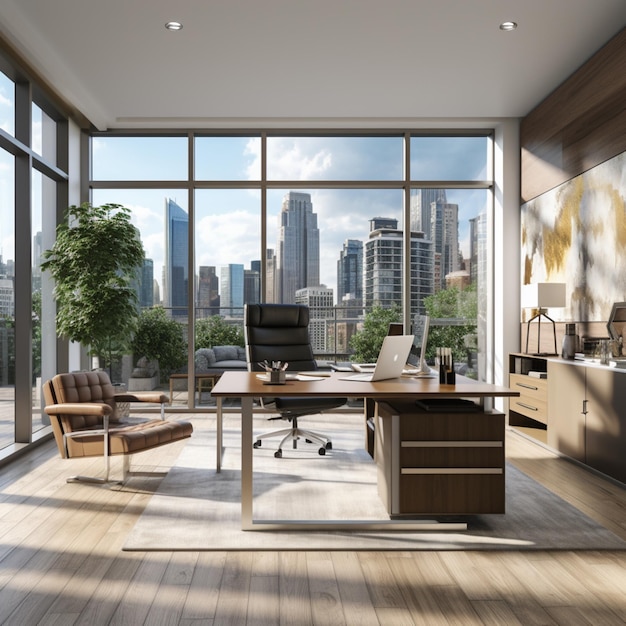
Identify the location of rug. This screenshot has height=626, width=626. (198, 476), (303, 481), (541, 529).